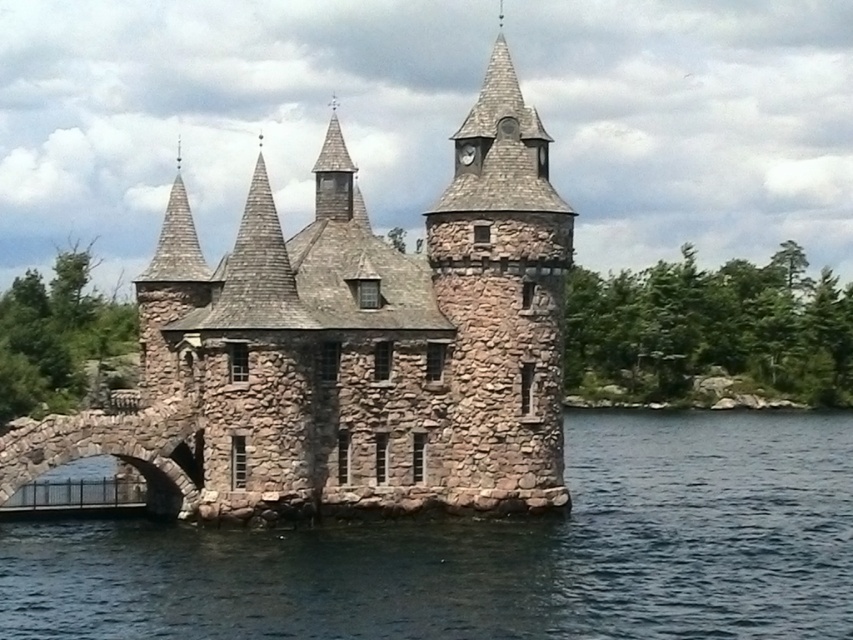
Consider the image. You are standing on the mainland and want to cross to the castle. The bridge is under maintenance. You have a small boat that can carry you and your gear. The boat requires at least 1 meter of clearance to pass safely. Can you determine if the distance between you and the clear blue water at lower center is sufficient for your boat to reach the castle?

The distance between the viewer and the clear blue water at lower center is 47.22 meters. Since the boat requires at least 1 meter of clearance, the distance is more than enough for the boat to safely navigate to the castle.

You are standing on the bridge leading to the castle. You see the clear blue water at lower center and the rustic stone tower at center. Which object is closer to you as you approach the castle from the bridge?

The clear blue water at lower center is closer to you because it is in front of the rustic stone tower at center, meaning it lies between you and the tower as you approach from the bridge.

You are standing at point (349, 346) in the image. What object is located exactly at this point?

The rustic stone castle at center is located exactly at point (349, 346).